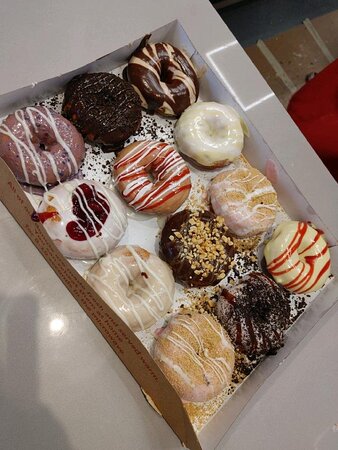
You are a GUI agent. You are given a task and a screenshot of the screen. Output one action in this format:
    pyautogui.click(x=<x>, y=<y>)
    Task: Click on the floor
    This screenshot has height=450, width=338.
    Given the screenshot: What is the action you would take?
    pyautogui.click(x=264, y=26)